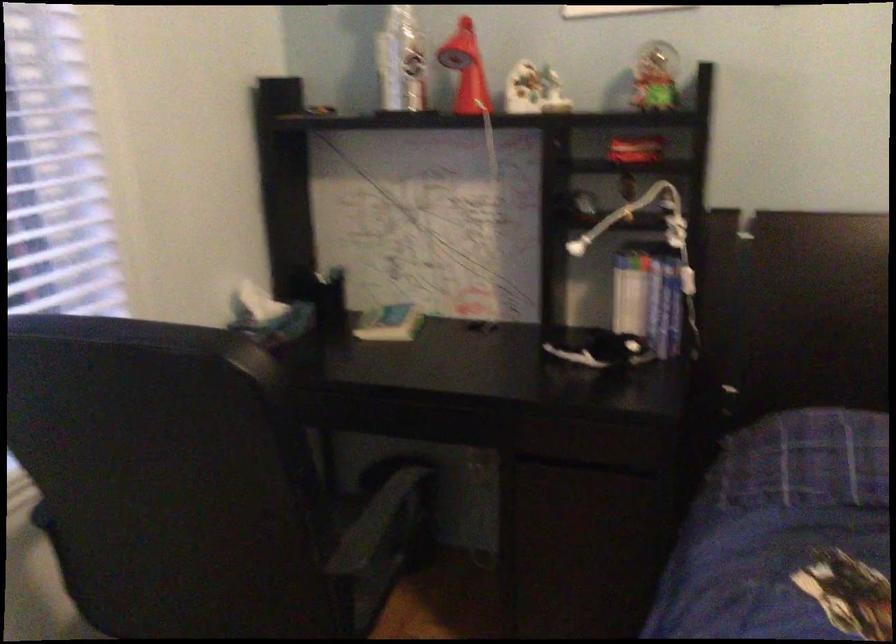
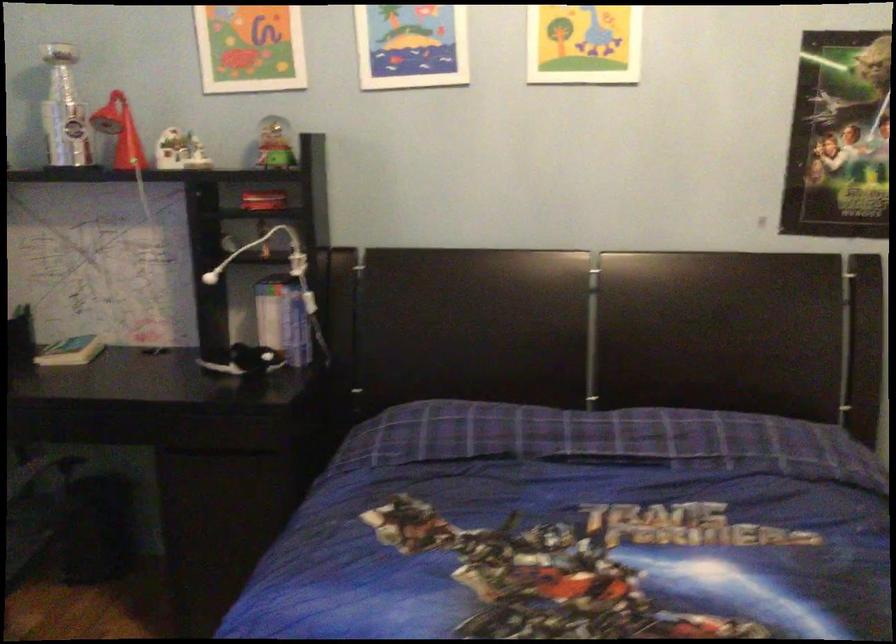
Where in the second image is the point corresponding to (657,80) from the first image?

(273, 144)